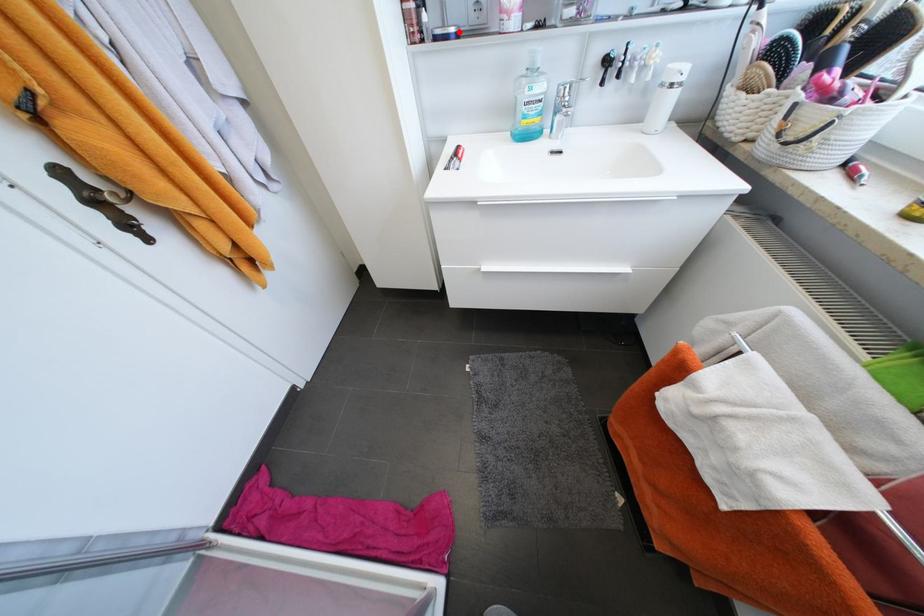
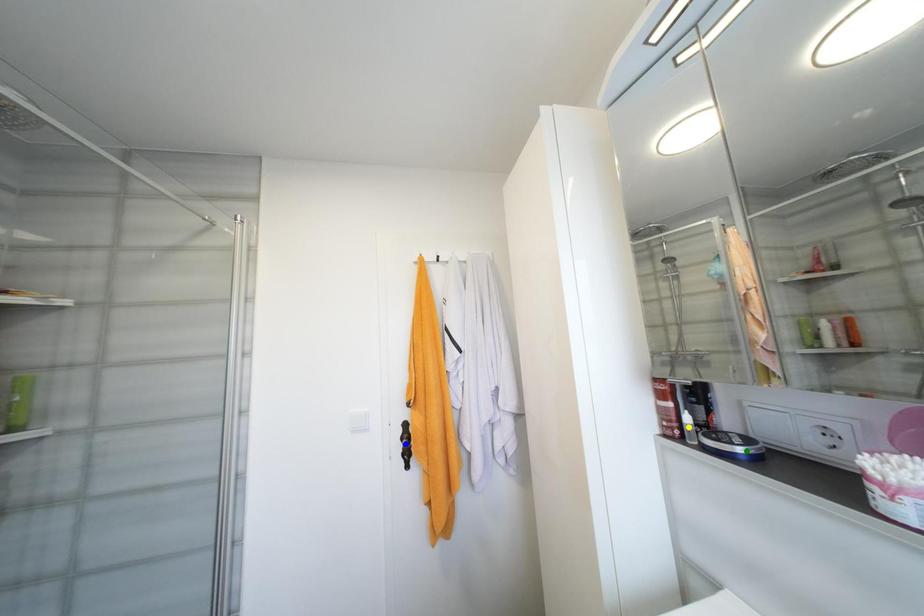
Question: I am providing you with two images of the same scene from different viewpoints. A red point is marked on the first image. You are given multiple points on the second image. Which mark in image 2 goes with the point in image 1?

Choices:
 (A) blue point
 (B) green point
 (C) yellow point

Answer: (B)